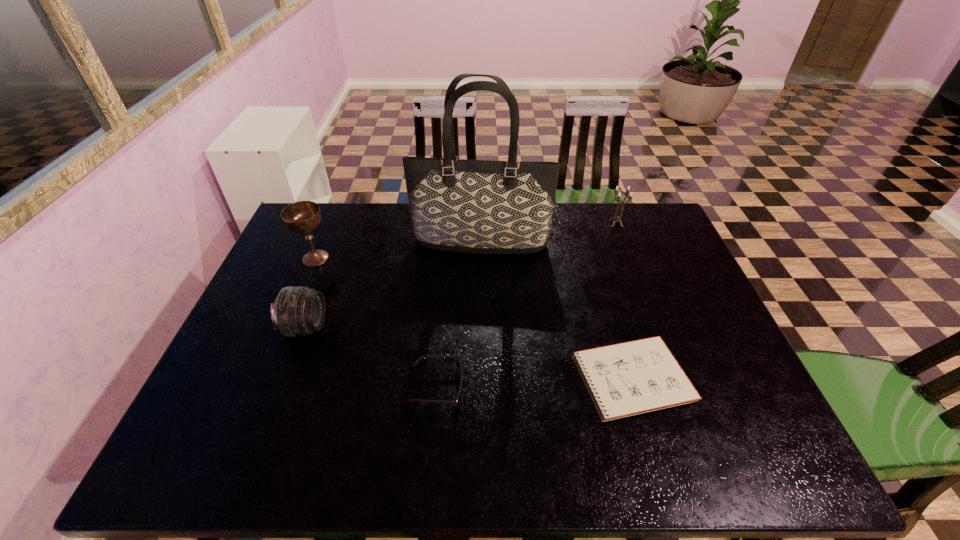
Find the location of a particular element. The height and width of the screenshot is (540, 960). vacant region between the chalice and the notepad is located at coordinates (472, 319).

Image resolution: width=960 pixels, height=540 pixels. Find the location of `object that is the closest to the shortest object`. object that is the closest to the shortest object is located at coordinates (458, 366).

Find the location of a particular element. This screenshot has width=960, height=540. object that is the fourth closest to the second tallest object is located at coordinates (631, 378).

This screenshot has width=960, height=540. In order to click on vacant area that satisfies the following two spatial constraints: 1. on the front side of the tote bag; 2. at the front element of the telephoto lens in this screenshot , I will do `click(481, 327)`.

The width and height of the screenshot is (960, 540). Find the location of `free location that satisfies the following two spatial constraints: 1. at the front element of the shortest object; 2. on the right side of the telephoto lens`. free location that satisfies the following two spatial constraints: 1. at the front element of the shortest object; 2. on the right side of the telephoto lens is located at coordinates (286, 379).